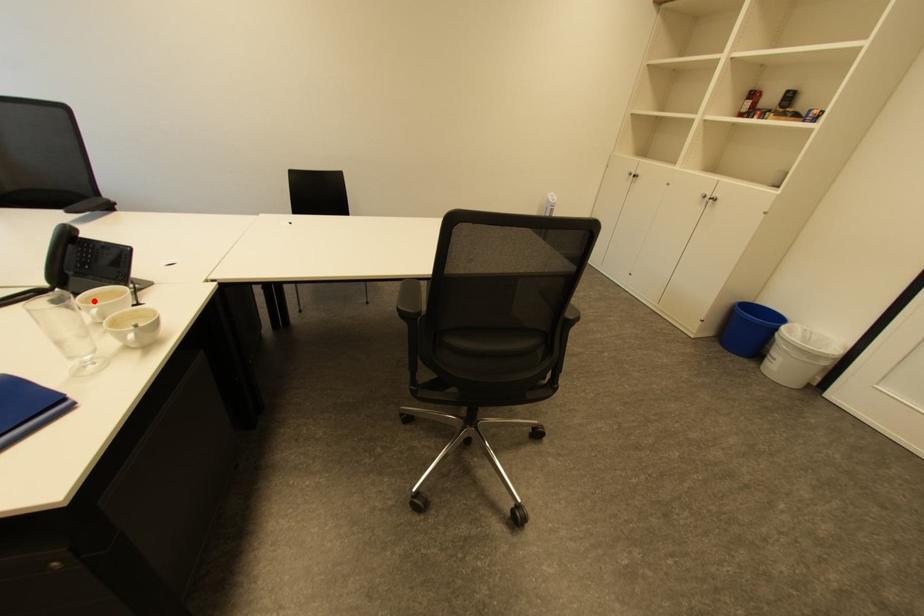
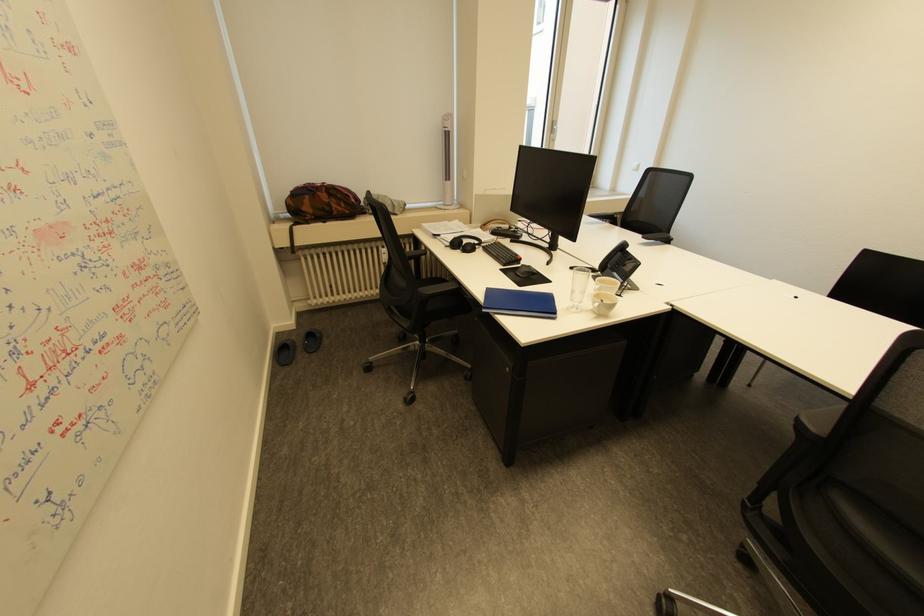
Question: I am providing you with two images of the same scene from different viewpoints. Given a red point in image1, look at the same physical point in image2. Is it:

Choices:
 (A) Closer to the viewpoint
 (B) Farther from the viewpoint

Answer: (B)